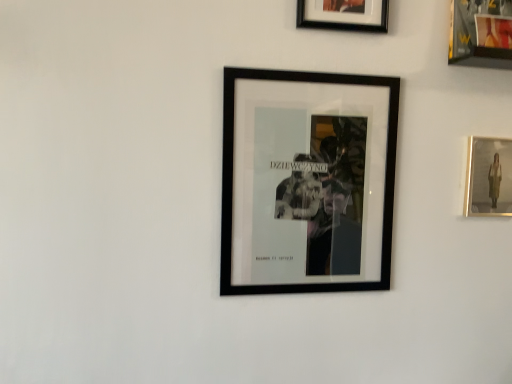
The width and height of the screenshot is (512, 384). What do you see at coordinates (481, 33) in the screenshot? I see `metallic gold picture frame at upper right, which appears as the 2th picture frame when viewed from the right` at bounding box center [481, 33].

The image size is (512, 384). In order to click on metallic gold picture frame at upper right, which appears as the 2th picture frame when viewed from the right in this screenshot , I will do `click(481, 33)`.

Describe the element at coordinates (307, 181) in the screenshot. I see `black matte picture frame at center, which appears as the first picture frame when viewed from the left` at that location.

What do you see at coordinates (344, 15) in the screenshot? The width and height of the screenshot is (512, 384). I see `black matte picture frame at upper center, which appears as the 3th picture frame when viewed from the right` at bounding box center [344, 15].

Identify the location of metallic gold picture frame at upper right, which is the third picture frame in left-to-right order. 481,33.

Which of these two, black matte picture frame at center, which appears as the 4th picture frame when viewed from the right, or black matte picture frame at upper center, which ranks as the 2th picture frame in left-to-right order, stands shorter?

black matte picture frame at upper center, which ranks as the 2th picture frame in left-to-right order, is shorter.

From a real-world perspective, starting from the black matte picture frame at upper center, which ranks as the 2th picture frame in left-to-right order, which picture frame is the 2nd one below it? Please provide its 2D coordinates.

[(307, 181)]

Is black matte picture frame at center, which appears as the first picture frame when viewed from the left, at the left side of black matte picture frame at upper center, which appears as the 3th picture frame when viewed from the right?

Yes.

Which of these two, black matte picture frame at center, which appears as the 4th picture frame when viewed from the right, or black matte picture frame at upper center, which appears as the 3th picture frame when viewed from the right, is thinner?

black matte picture frame at upper center, which appears as the 3th picture frame when viewed from the right, is thinner.

Measure the distance from matte gold picture frame at right, positioned as the 1th picture frame in right-to-left order, to black matte picture frame at center, which appears as the first picture frame when viewed from the left.

16.37 inches.

Can you confirm if matte gold picture frame at right, positioned as the fourth picture frame in left-to-right order, is positioned to the right of black matte picture frame at center, which appears as the first picture frame when viewed from the left?

Yes, matte gold picture frame at right, positioned as the fourth picture frame in left-to-right order, is to the right of black matte picture frame at center, which appears as the first picture frame when viewed from the left.

Which of these two, matte gold picture frame at right, positioned as the fourth picture frame in left-to-right order, or black matte picture frame at center, which appears as the 4th picture frame when viewed from the right, stands taller?

black matte picture frame at center, which appears as the 4th picture frame when viewed from the right.

What's the angular difference between matte gold picture frame at right, positioned as the 1th picture frame in right-to-left order, and black matte picture frame at center, which appears as the 4th picture frame when viewed from the right,'s facing directions?

The angle between the facing direction of matte gold picture frame at right, positioned as the 1th picture frame in right-to-left order, and the facing direction of black matte picture frame at center, which appears as the 4th picture frame when viewed from the right, is 0.00707 degrees.

What's the angular difference between black matte picture frame at upper center, which ranks as the 2th picture frame in left-to-right order, and black matte picture frame at center, which appears as the first picture frame when viewed from the left,'s facing directions?

There is a 2.86-degree angle between the facing directions of black matte picture frame at upper center, which ranks as the 2th picture frame in left-to-right order, and black matte picture frame at center, which appears as the first picture frame when viewed from the left.

Identify the location of picture frame located in front of the black matte picture frame at upper center, which appears as the 3th picture frame when viewed from the right. (307, 181).

Based on the photo, from a real-world perspective, is black matte picture frame at upper center, which appears as the 3th picture frame when viewed from the right, located beneath black matte picture frame at center, which appears as the first picture frame when viewed from the left?

Incorrect, from a real-world perspective, black matte picture frame at upper center, which appears as the 3th picture frame when viewed from the right, is higher than black matte picture frame at center, which appears as the first picture frame when viewed from the left.

Between black matte picture frame at upper center, which appears as the 3th picture frame when viewed from the right, and black matte picture frame at center, which appears as the first picture frame when viewed from the left, which one has smaller size?

black matte picture frame at upper center, which appears as the 3th picture frame when viewed from the right, is smaller.

From a real-world perspective, between metallic gold picture frame at upper right, which appears as the 2th picture frame when viewed from the right, and black matte picture frame at upper center, which appears as the 3th picture frame when viewed from the right, who is vertically higher?

metallic gold picture frame at upper right, which appears as the 2th picture frame when viewed from the right.

Considering the positions of objects metallic gold picture frame at upper right, which is the third picture frame in left-to-right order, and black matte picture frame at upper center, which appears as the 3th picture frame when viewed from the right, in the image provided, who is more to the left, metallic gold picture frame at upper right, which is the third picture frame in left-to-right order, or black matte picture frame at upper center, which appears as the 3th picture frame when viewed from the right,?

From the viewer's perspective, black matte picture frame at upper center, which appears as the 3th picture frame when viewed from the right, appears more on the left side.

Locate an element on the screen. The height and width of the screenshot is (384, 512). the 1st picture frame below the metallic gold picture frame at upper right, which is the third picture frame in left-to-right order (from the image's perspective) is located at coordinates (344, 15).

Which point is more distant from viewer, [481,18] or [370,136]?

Point [370,136]

Is metallic gold picture frame at upper right, which appears as the 2th picture frame when viewed from the right, taller than black matte picture frame at center, which appears as the 4th picture frame when viewed from the right?

Incorrect, the height of metallic gold picture frame at upper right, which appears as the 2th picture frame when viewed from the right, is not larger of that of black matte picture frame at center, which appears as the 4th picture frame when viewed from the right.

Is metallic gold picture frame at upper right, which appears as the 2th picture frame when viewed from the right, placed right next to black matte picture frame at center, which appears as the 4th picture frame when viewed from the right?

No.

Is black matte picture frame at center, which appears as the 4th picture frame when viewed from the right, facing towards matte gold picture frame at right, positioned as the 1th picture frame in right-to-left order?

No, black matte picture frame at center, which appears as the 4th picture frame when viewed from the right, is not turned towards matte gold picture frame at right, positioned as the 1th picture frame in right-to-left order.

From a real-world perspective, is black matte picture frame at center, which appears as the 4th picture frame when viewed from the right, beneath matte gold picture frame at right, positioned as the 1th picture frame in right-to-left order?

Yes.

Is metallic gold picture frame at upper right, which is the third picture frame in left-to-right order, directly adjacent to matte gold picture frame at right, positioned as the 1th picture frame in right-to-left order?

metallic gold picture frame at upper right, which is the third picture frame in left-to-right order, is not next to matte gold picture frame at right, positioned as the 1th picture frame in right-to-left order, and they're not touching.

Is metallic gold picture frame at upper right, which is the third picture frame in left-to-right order, facing away from matte gold picture frame at right, positioned as the 1th picture frame in right-to-left order?

No, metallic gold picture frame at upper right, which is the third picture frame in left-to-right order,'s orientation is not away from matte gold picture frame at right, positioned as the 1th picture frame in right-to-left order.

Looking at this image, does metallic gold picture frame at upper right, which appears as the 2th picture frame when viewed from the right, have a smaller size compared to matte gold picture frame at right, positioned as the 1th picture frame in right-to-left order?

No, metallic gold picture frame at upper right, which appears as the 2th picture frame when viewed from the right, is not smaller than matte gold picture frame at right, positioned as the 1th picture frame in right-to-left order.

Is point (460, 16) closer to viewer compared to point (484, 206)?

Yes, it is.

Identify the location of the 1st picture frame behind the black matte picture frame at center, which appears as the first picture frame when viewed from the left, counting from the anchor's position. Image resolution: width=512 pixels, height=384 pixels. (344, 15).

Which picture frame is the 3rd one when counting from the left side of the matte gold picture frame at right, positioned as the fourth picture frame in left-to-right order? Please provide its 2D coordinates.

[(307, 181)]

Estimate the real-world distances between objects in this image. Which object is further from black matte picture frame at upper center, which appears as the 3th picture frame when viewed from the right, metallic gold picture frame at upper right, which is the third picture frame in left-to-right order, or matte gold picture frame at right, positioned as the fourth picture frame in left-to-right order?

The object further to black matte picture frame at upper center, which appears as the 3th picture frame when viewed from the right, is matte gold picture frame at right, positioned as the fourth picture frame in left-to-right order.

Looking at the image, which one is located further to black matte picture frame at upper center, which appears as the 3th picture frame when viewed from the right, metallic gold picture frame at upper right, which appears as the 2th picture frame when viewed from the right, or black matte picture frame at center, which appears as the 4th picture frame when viewed from the right?

black matte picture frame at center, which appears as the 4th picture frame when viewed from the right, is positioned further to the anchor black matte picture frame at upper center, which appears as the 3th picture frame when viewed from the right.

Based on the photo, when comparing their distances from matte gold picture frame at right, positioned as the 1th picture frame in right-to-left order, does black matte picture frame at upper center, which appears as the 3th picture frame when viewed from the right, or black matte picture frame at center, which appears as the 4th picture frame when viewed from the right, seem closer?

black matte picture frame at center, which appears as the 4th picture frame when viewed from the right, is positioned closer to the anchor matte gold picture frame at right, positioned as the 1th picture frame in right-to-left order.

From the image, which object appears to be farther from black matte picture frame at center, which appears as the first picture frame when viewed from the left, matte gold picture frame at right, positioned as the fourth picture frame in left-to-right order, or metallic gold picture frame at upper right, which is the third picture frame in left-to-right order?

The object further to black matte picture frame at center, which appears as the first picture frame when viewed from the left, is metallic gold picture frame at upper right, which is the third picture frame in left-to-right order.

From the image, which object appears to be farther from black matte picture frame at upper center, which appears as the 3th picture frame when viewed from the right, black matte picture frame at center, which appears as the first picture frame when viewed from the left, or matte gold picture frame at right, positioned as the 1th picture frame in right-to-left order?

matte gold picture frame at right, positioned as the 1th picture frame in right-to-left order, lies further to black matte picture frame at upper center, which appears as the 3th picture frame when viewed from the right, than the other object.

From the picture: Based on their spatial positions, is black matte picture frame at center, which appears as the first picture frame when viewed from the left, or black matte picture frame at upper center, which appears as the 3th picture frame when viewed from the right, closer to metallic gold picture frame at upper right, which is the third picture frame in left-to-right order?

black matte picture frame at upper center, which appears as the 3th picture frame when viewed from the right, is closer to metallic gold picture frame at upper right, which is the third picture frame in left-to-right order.

Looking at the image, which one is located closer to black matte picture frame at center, which appears as the first picture frame when viewed from the left, metallic gold picture frame at upper right, which is the third picture frame in left-to-right order, or matte gold picture frame at right, positioned as the 1th picture frame in right-to-left order?

matte gold picture frame at right, positioned as the 1th picture frame in right-to-left order, is positioned closer to the anchor black matte picture frame at center, which appears as the first picture frame when viewed from the left.

From the image, which object appears to be farther from matte gold picture frame at right, positioned as the 1th picture frame in right-to-left order, black matte picture frame at upper center, which ranks as the 2th picture frame in left-to-right order, or metallic gold picture frame at upper right, which is the third picture frame in left-to-right order?

Based on the image, black matte picture frame at upper center, which ranks as the 2th picture frame in left-to-right order, appears to be further to matte gold picture frame at right, positioned as the 1th picture frame in right-to-left order.

This screenshot has height=384, width=512. Identify the location of picture frame between metallic gold picture frame at upper right, which appears as the 2th picture frame when viewed from the right, and matte gold picture frame at right, positioned as the fourth picture frame in left-to-right order, in the vertical direction. pyautogui.click(x=344, y=15).